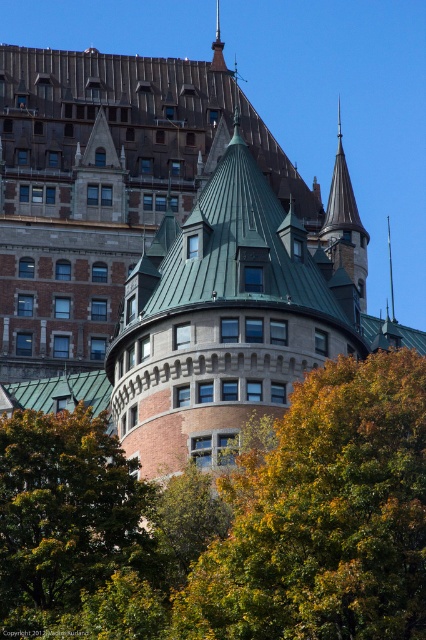
You are standing in front of the grand historic building and want to take a photo that includes both the brown stone tower at center and the smooth gray stone tower at upper right. Which tower should you position closer to the camera to ensure both are visible in the frame?

You should position the brown stone tower at center closer to the camera because it is in front of the smooth gray stone tower at upper right, so keeping it closer will ensure both are visible without one blocking the other.

Looking at the grand historic building, where is the brown stone tower at center in relation to the smooth gray stone tower at upper right?

The brown stone tower at center is located to the left of the smooth gray stone tower at upper right.

You are an architect examining the facade of this historic building. You need to determine the vertical arrangement of the brown stone tower at center and the smooth gray stone tower at upper right. Which tower is positioned higher on the building?

The smooth gray stone tower at upper right is positioned higher on the building than the brown stone tower at center because the brown stone tower at center is located below it.